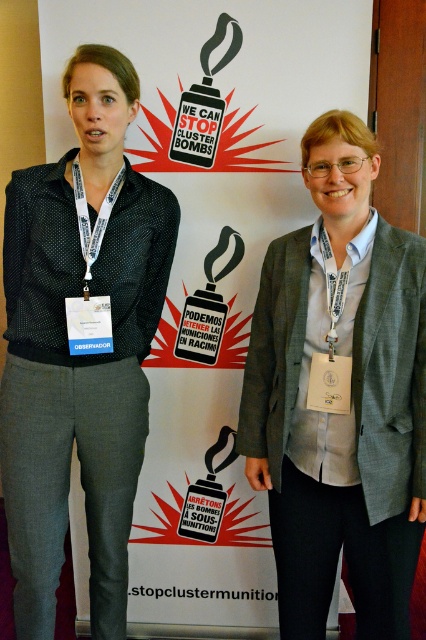
Between gray textured blazer at center and black dotted shirt at left, which one has more height?

black dotted shirt at left is taller.

Can you confirm if gray textured blazer at center is thinner than black dotted shirt at left?

Indeed, gray textured blazer at center has a lesser width compared to black dotted shirt at left.

Between point (328, 221) and point (120, 252), which one is positioned in front?

Point (328, 221)

Image resolution: width=426 pixels, height=640 pixels. I want to click on gray textured blazer at center, so click(339, 394).